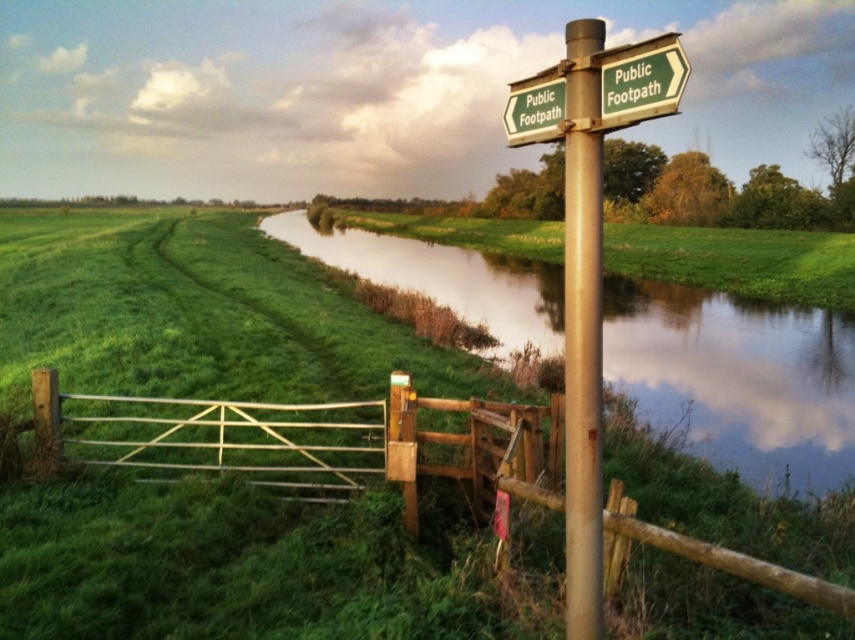
Who is shorter, green grassy river at center or green grassy at center?

green grassy river at center is shorter.

Does green grassy river at center appear on the right side of green grassy at center?

Indeed, green grassy river at center is positioned on the right side of green grassy at center.

Locate an element on the screen. This screenshot has height=640, width=855. green grassy river at center is located at coordinates (736, 378).

Does metallic pole at center-right have a greater width compared to green wooden signpost at upper right?

Yes, metallic pole at center-right is wider than green wooden signpost at upper right.

Between metallic pole at center-right and green wooden signpost at upper right, which one appears on the right side from the viewer's perspective?

metallic pole at center-right

Does point (594, 33) lie in front of point (553, 97)?

Yes, it is in front of point (553, 97).

Where is `metallic pole at center-right`? The image size is (855, 640). metallic pole at center-right is located at coordinates (582, 328).

Looking at this image, does wooden gate at center have a lesser width compared to green wooden signpost at upper right?

Yes.

Based on the photo, is wooden gate at center to the right of green wooden signpost at upper right from the viewer's perspective?

No, wooden gate at center is not to the right of green wooden signpost at upper right.

Is point (286, 422) positioned behind point (514, 90)?

Yes, it is behind point (514, 90).

Find the location of a particular element. wooden gate at center is located at coordinates (334, 442).